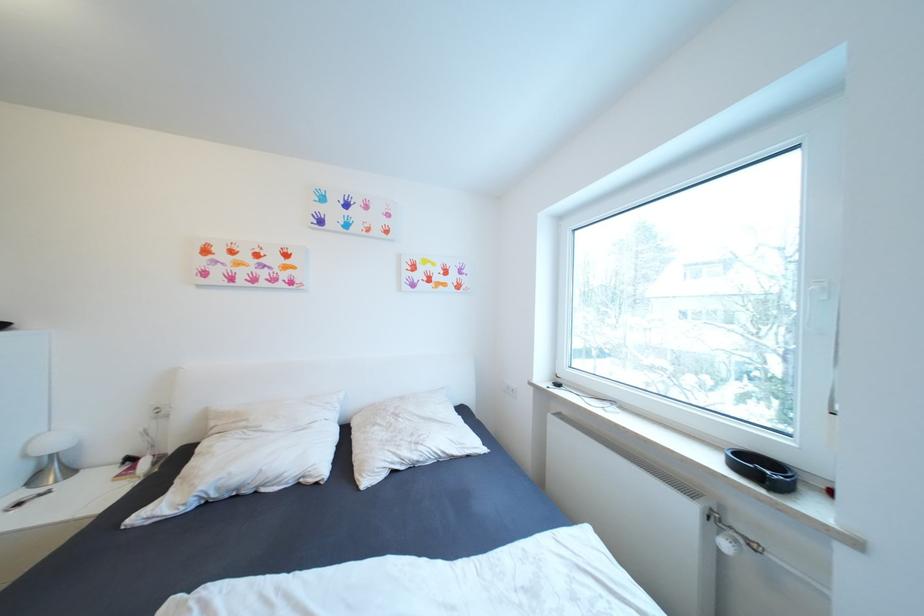
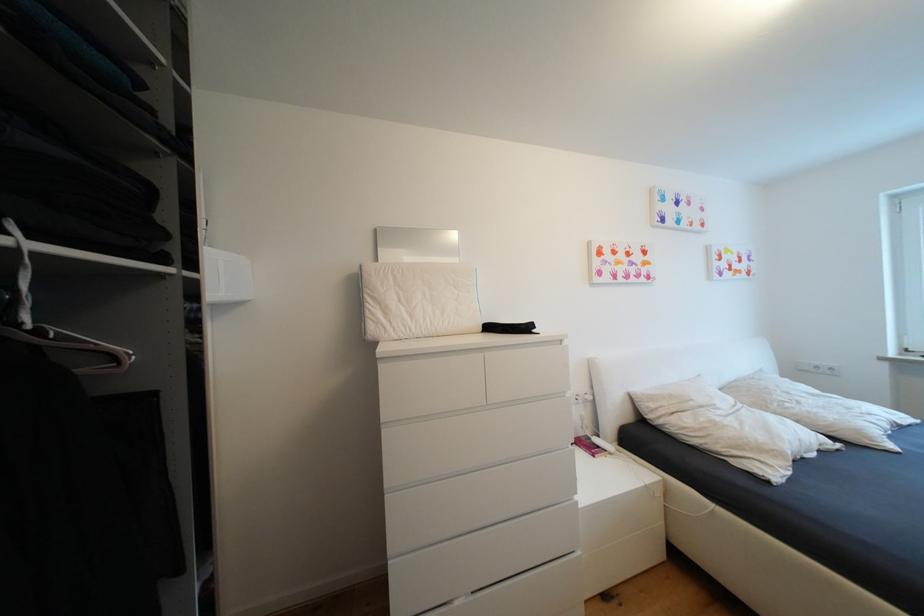
Question: In a continuous first-person perspective shot, in which direction is the camera moving?

Choices:
 (A) Left
 (B) Right
 (C) Forward
 (D) Backward

Answer: (A)